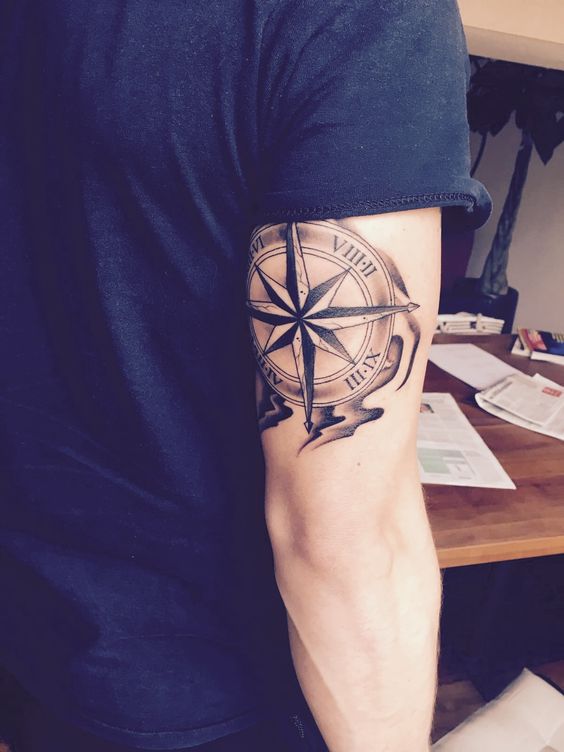
At what (x,y) coordinates should I click in order to perform the action: click on plant. Please return your answer as a coordinate pair (x, y). Image resolution: width=564 pixels, height=752 pixels. Looking at the image, I should click on (522, 177).